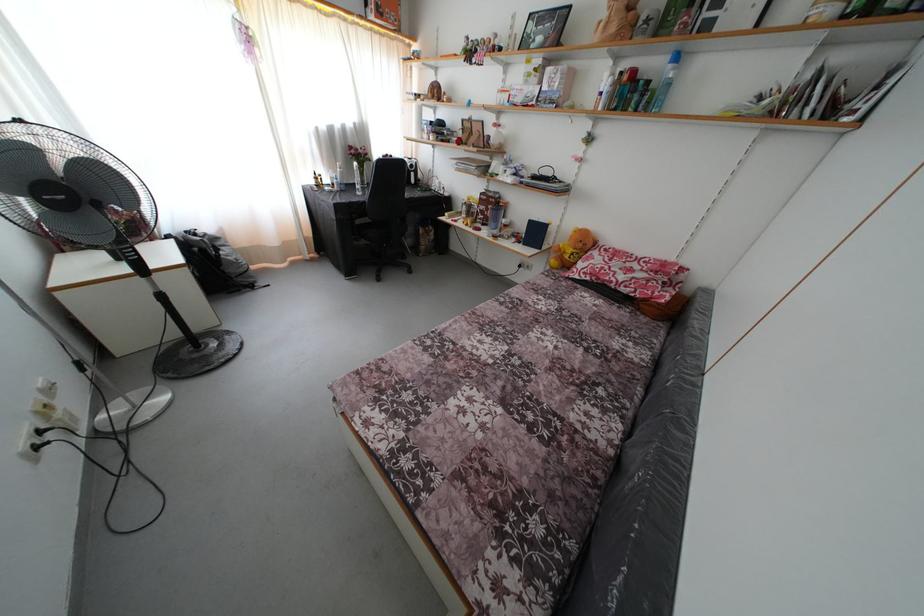
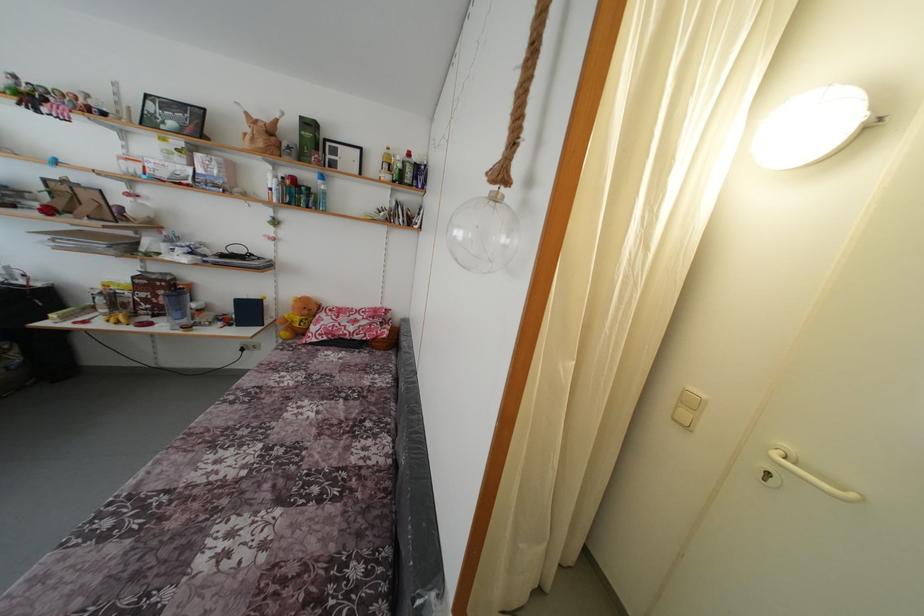
In the second image, find the point that corresponds to [675,73] in the first image.

(324, 188)